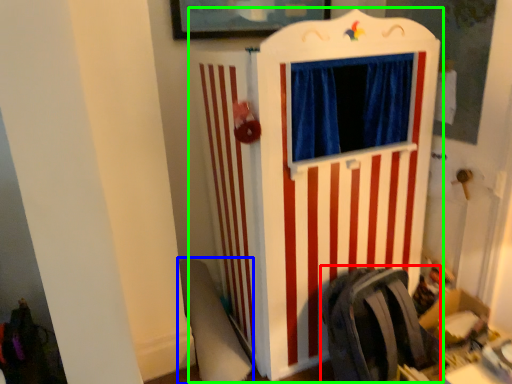
Question: Considering the real-world distances, which object is farthest from folding chair (highlighted by a red box)? swivel chair (highlighted by a blue box) or furniture (highlighted by a green box)?

Choices:
 (A) swivel chair
 (B) furniture

Answer: (A)